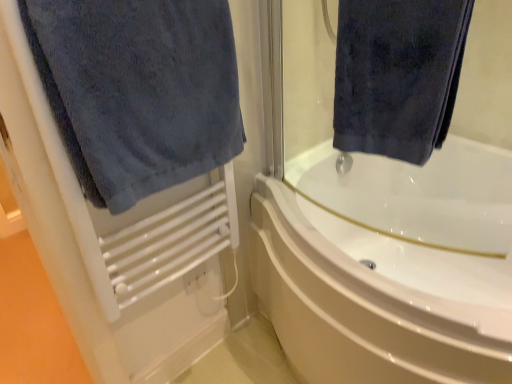
Question: Is dark blue towel at left, arranged as the 2th towel when viewed from the right, looking in the opposite direction of white glossy bathtub at center?

Choices:
 (A) yes
 (B) no

Answer: (B)

Question: Is dark blue towel at left, which is counted as the 1th towel, starting from the left, to the right of white glossy bathtub at center from the viewer's perspective?

Choices:
 (A) yes
 (B) no

Answer: (B)

Question: From a real-world perspective, does dark blue towel at left, arranged as the 2th towel when viewed from the right, sit lower than white glossy bathtub at center?

Choices:
 (A) no
 (B) yes

Answer: (A)

Question: Is white glossy bathtub at center a part of dark blue towel at left, arranged as the 2th towel when viewed from the right?

Choices:
 (A) no
 (B) yes

Answer: (A)

Question: Is dark blue towel at left, arranged as the 2th towel when viewed from the right, next to white glossy bathtub at center?

Choices:
 (A) no
 (B) yes

Answer: (A)

Question: Is there a large distance between dark blue towel at left, which is counted as the 1th towel, starting from the left, and white glossy bathtub at center?

Choices:
 (A) yes
 (B) no

Answer: (B)

Question: Is the depth of white glossy bathtub at center greater than that of dark blue towel at left, arranged as the 2th towel when viewed from the right?

Choices:
 (A) no
 (B) yes

Answer: (B)

Question: Can you see white glossy bathtub at center touching dark blue towel at left, arranged as the 2th towel when viewed from the right?

Choices:
 (A) yes
 (B) no

Answer: (B)

Question: Is white glossy bathtub at center facing away from dark blue towel at left, which is counted as the 1th towel, starting from the left?

Choices:
 (A) no
 (B) yes

Answer: (A)

Question: From the image's perspective, is white glossy bathtub at center on dark blue towel at left, which is counted as the 1th towel, starting from the left?

Choices:
 (A) yes
 (B) no

Answer: (B)

Question: Can you confirm if white glossy bathtub at center is bigger than dark blue towel at left, arranged as the 2th towel when viewed from the right?

Choices:
 (A) no
 (B) yes

Answer: (B)

Question: Can you confirm if white glossy bathtub at center is positioned to the right of dark blue towel at left, arranged as the 2th towel when viewed from the right?

Choices:
 (A) no
 (B) yes

Answer: (B)

Question: Is white glossy bathtub at center not within dark blue velvety towel at upper right, the second towel in the left-to-right sequence?

Choices:
 (A) no
 (B) yes

Answer: (B)